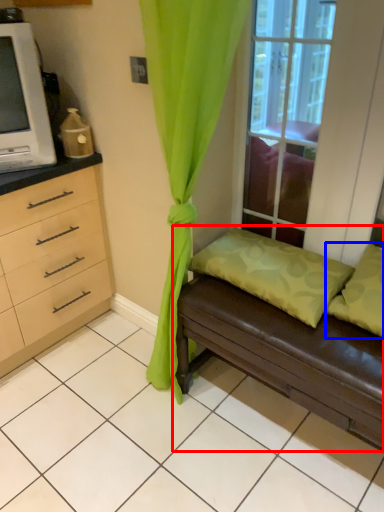
Question: Which point is further to the camera, studio couch (highlighted by a red box) or pillow (highlighted by a blue box)?

Choices:
 (A) studio couch
 (B) pillow

Answer: (B)